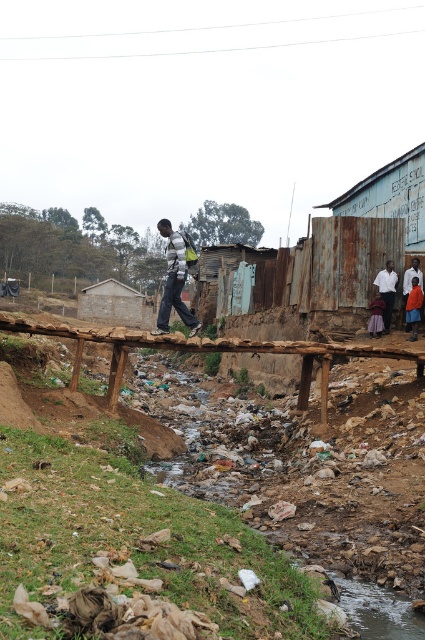
You are a drone operator trying to capture an aerial view of the brown wooden bridge at center. What are the coordinates of the bridge?

The coordinates of the brown wooden bridge at center are at point [206,349].

You are a hiker who has just arrived at the wooden bridge over the stream. You notice two items in the scene. One is a striped sweater at center and the other is an orange fabric skirt at lower right. Which item is taller?

The striped sweater at center is taller than the orange fabric skirt at lower right.